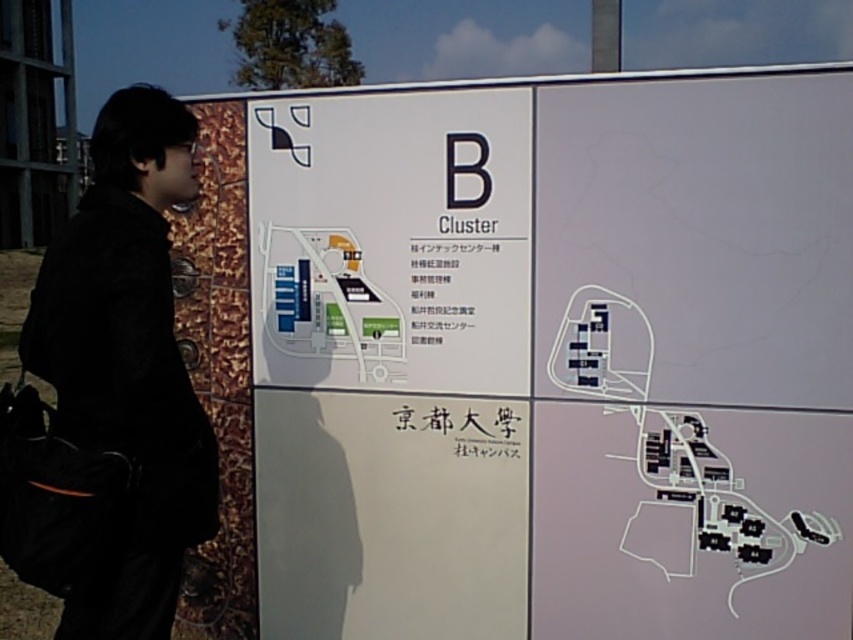
Can you confirm if white paper sign at center is positioned to the right of black fabric jacket at left?

Yes, white paper sign at center is to the right of black fabric jacket at left.

Measure the distance between point (408, 100) and camera.

Point (408, 100) is 9.86 feet from camera.

In order to click on white paper sign at center in this screenshot , I will do `click(392, 241)`.

Does white paper map at upper center appear on the left side of black fabric jacket at left?

Incorrect, white paper map at upper center is not on the left side of black fabric jacket at left.

Locate an element on the screen. This screenshot has width=853, height=640. white paper map at upper center is located at coordinates (555, 358).

Where is `white paper map at upper center`? The height and width of the screenshot is (640, 853). white paper map at upper center is located at coordinates (555, 358).

Who is taller, white paper map at upper center or white paper sign at center?

Standing taller between the two is white paper map at upper center.

Can you confirm if white paper map at upper center is thinner than white paper sign at center?

No.

Locate an element on the screen. white paper map at upper center is located at coordinates (555, 358).